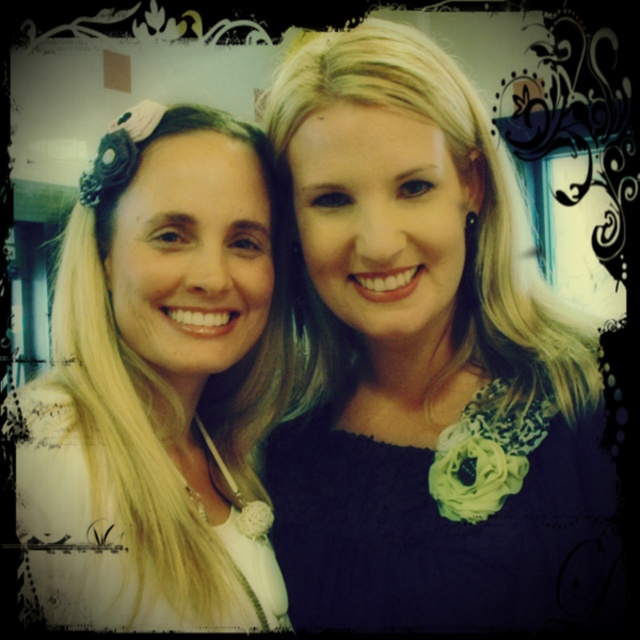
You are trying to decide which outfit to wear for a formal event. You see the matte black dress at center and the white lace top at left in the image. Based on their positions, which one is more likely to be the main focal point of the image?

The matte black dress at center is to the right of the white lace top at left, so it is positioned closer to the center of the image, making it the main focal point.

You are a photographer setting up a shoot. You have two outfits to choose from for the model. The matte black dress at center and the white lace top at left. Based on their heights in the image, which outfit would you recommend if you want the model to appear taller?

The matte black dress at center has a greater height compared to the white lace top at left, so I would recommend the matte black dress at center to make the model appear taller.

You are a photographer setting up a studio shoot. You have two outfits to feature in the same frame. The matte black dress at center and the white lace top at left. Given their sizes, which outfit should you place closer to the camera to ensure both are visible without overlapping?

Since the matte black dress at center is wider than the white lace top at left, you should place the wider matte black dress at center closer to the camera to prevent overlapping and ensure both outfits are visible.